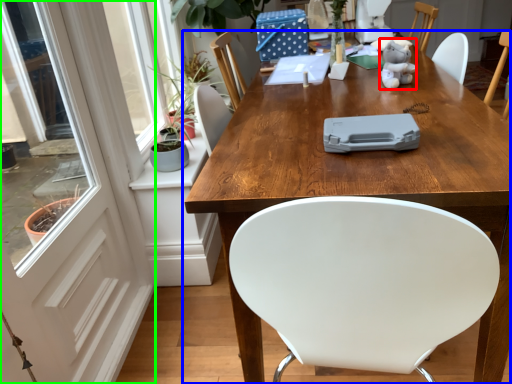
Question: Which object is positioned closest to toy (highlighted by a red box)? Select from table (highlighted by a blue box) and screen door (highlighted by a green box).

Choices:
 (A) table
 (B) screen door

Answer: (A)